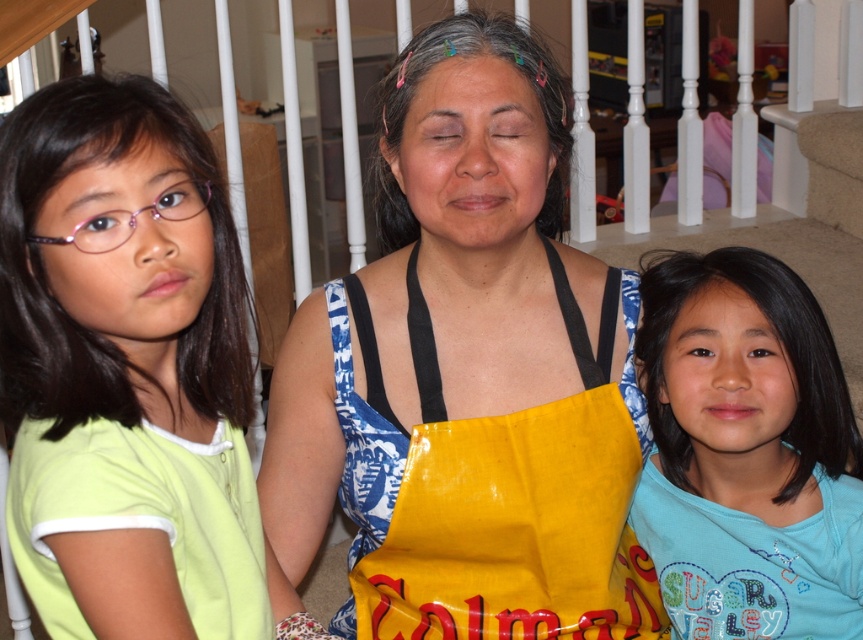
Based on the photo, you are trying to decide which child to give a gift to based on their clothing size. The gift is a large stuffed animal that needs to fit in their shirt pocket. Which child, the one wearing the light green shirt at left or the blue cotton shirt at right, is more likely to have a larger shirt pocket?

The blue cotton shirt at right occupies more space than the light green shirt at left, so it likely has a larger shirt pocket to accommodate its size.

Based on the photo, you are standing at the point marked as point (60, 268) in the image. You want to reach the living room door located 10 feet away from your current position. If you walk straight ahead, will you be able to reach the door without any obstacles?

The point marked as point (60, 268) and the viewer are 30.44 inches apart. Since 30.44 inches is approximately 2.54 feet, which is less than 10 feet, you would need to continue walking beyond your current position to reach the door located 10 feet away. However, the image does not provide information about potential obstacles between the point and the door, so it is uncertain if there are any hindrances in your path.